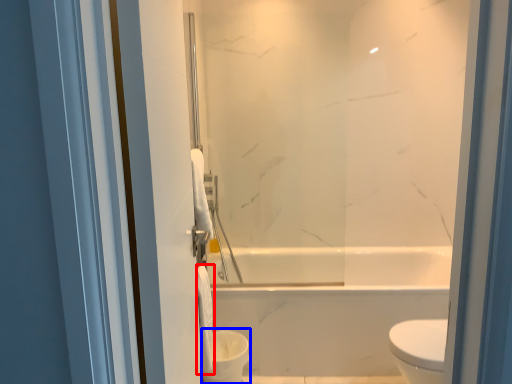
Question: Among these objects, which one is nearest to the camera, toilet paper (highlighted by a red box) or toilet bowl (highlighted by a blue box)?

Choices:
 (A) toilet paper
 (B) toilet bowl

Answer: (A)